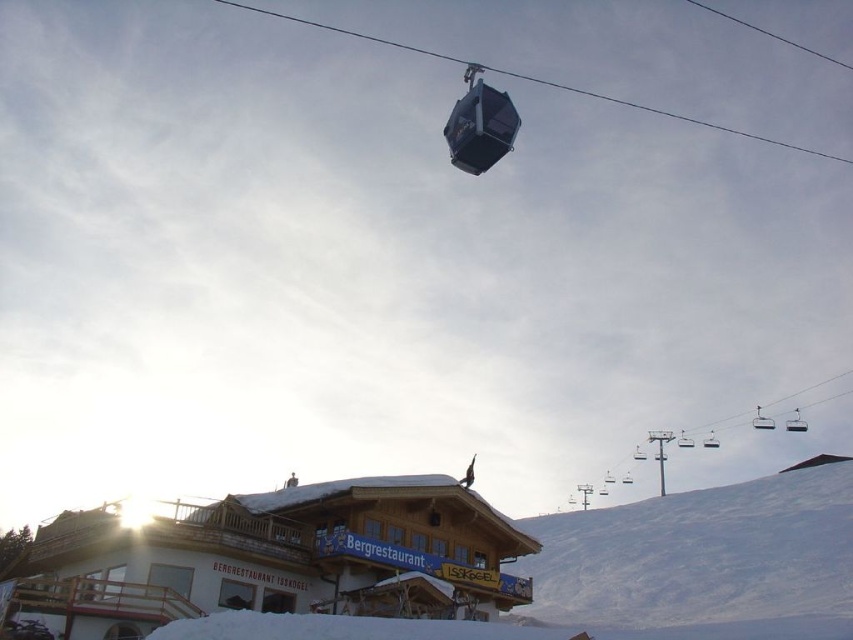
How far apart are wooden cabin at lower center and white snow at upper right?

wooden cabin at lower center is 51.97 meters from white snow at upper right.

Is point (132, 636) farther from camera compared to point (811, 557)?

No, (132, 636) is in front of (811, 557).

Where is `wooden cabin at lower center`? The height and width of the screenshot is (640, 853). wooden cabin at lower center is located at coordinates (276, 557).

Image resolution: width=853 pixels, height=640 pixels. I want to click on wooden cabin at lower center, so click(x=276, y=557).